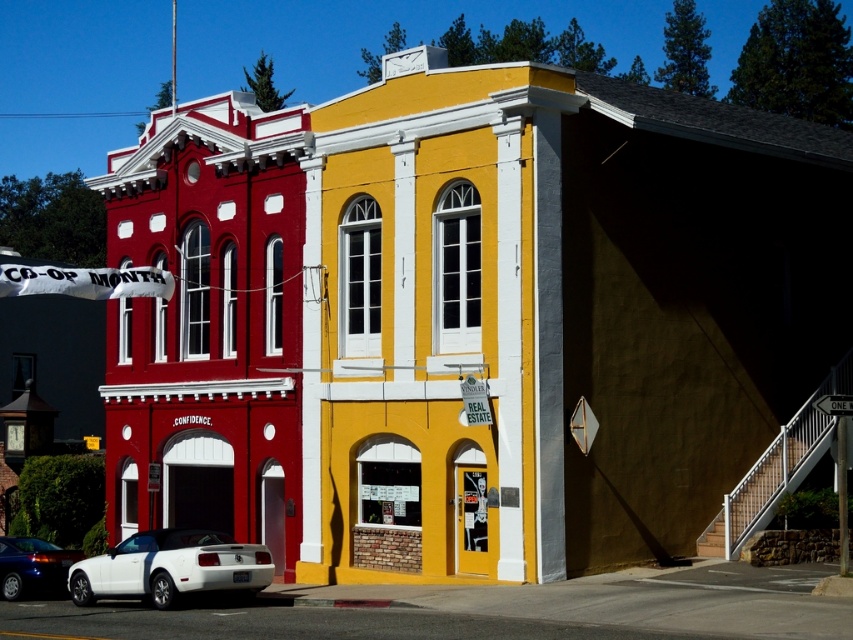
Question: Does white matte convertible at lower left have a greater width compared to metallic blue car at lower left?

Choices:
 (A) yes
 (B) no

Answer: (A)

Question: Observing the image, what is the correct spatial positioning of white matte convertible at lower left in reference to metallic blue car at lower left?

Choices:
 (A) above
 (B) below

Answer: (A)

Question: Considering the relative positions of white matte convertible at lower left and metallic blue car at lower left in the image provided, where is white matte convertible at lower left located with respect to metallic blue car at lower left?

Choices:
 (A) right
 (B) left

Answer: (A)

Question: Which point appears farthest from the camera in this image?

Choices:
 (A) (216, 582)
 (B) (4, 561)

Answer: (B)

Question: Which object appears closest to the camera in this image?

Choices:
 (A) white matte convertible at lower left
 (B) metallic blue car at lower left

Answer: (A)